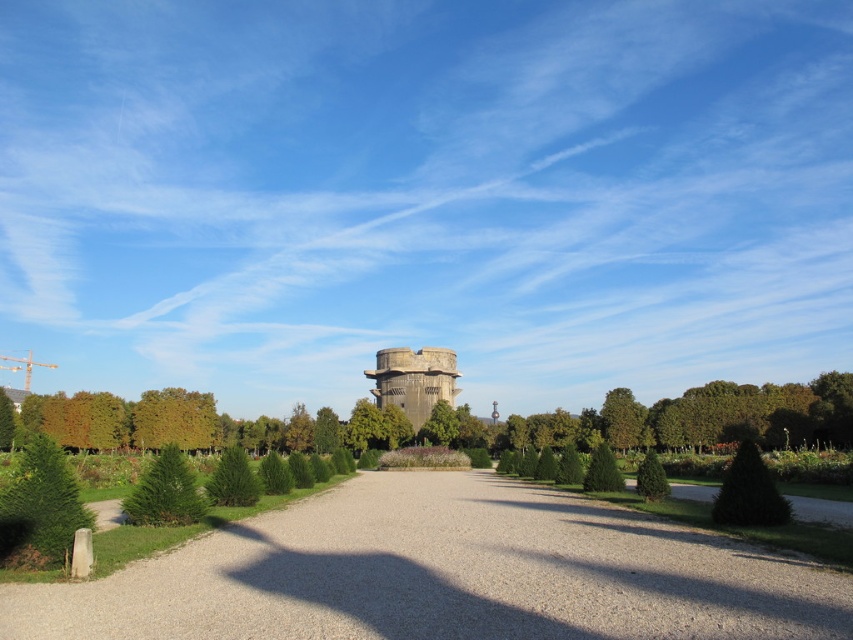
Question: Is gray concrete water tower at center to the left of green textured bush at center-right from the viewer's perspective?

Choices:
 (A) yes
 (B) no

Answer: (A)

Question: Which point is farther from the camera taking this photo?

Choices:
 (A) (248, 541)
 (B) (51, 467)
 (C) (653, 452)
 (D) (788, 515)

Answer: (C)

Question: Can you confirm if gray concrete water tower at center is positioned to the left of green textured bush at center-right?

Choices:
 (A) yes
 (B) no

Answer: (A)

Question: Can you confirm if gray gravel driveway at center is positioned to the right of green leafy tree at left?

Choices:
 (A) yes
 (B) no

Answer: (A)

Question: Which object is the closest to the green leafy tree at left?

Choices:
 (A) gray concrete water tower at center
 (B) green leafy tree at center

Answer: (A)

Question: Estimate the real-world distances between objects in this image. Which object is farther from the dark green textured bush at lower right?

Choices:
 (A) green textured bush at center-right
 (B) green leafy tree at center
 (C) gray gravel driveway at center

Answer: (B)